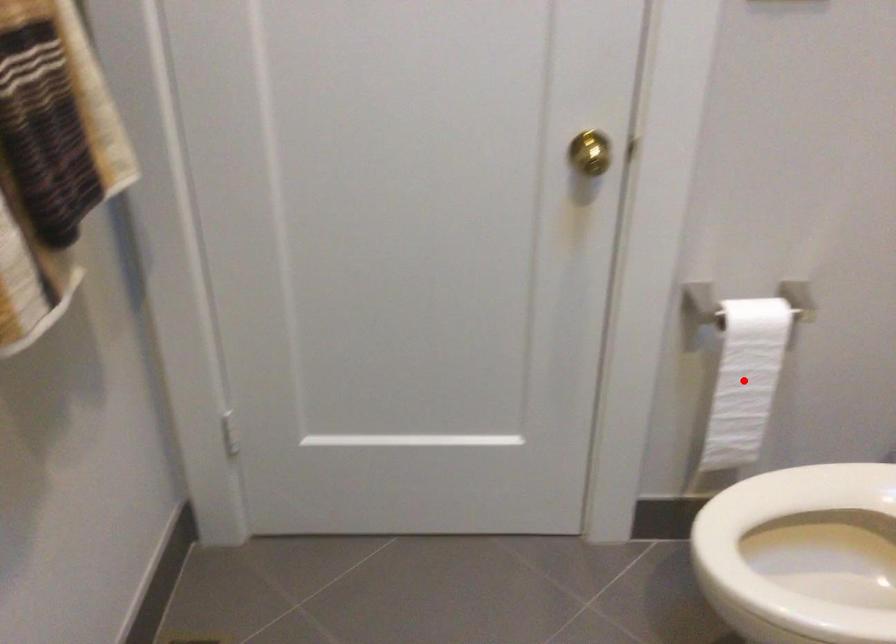
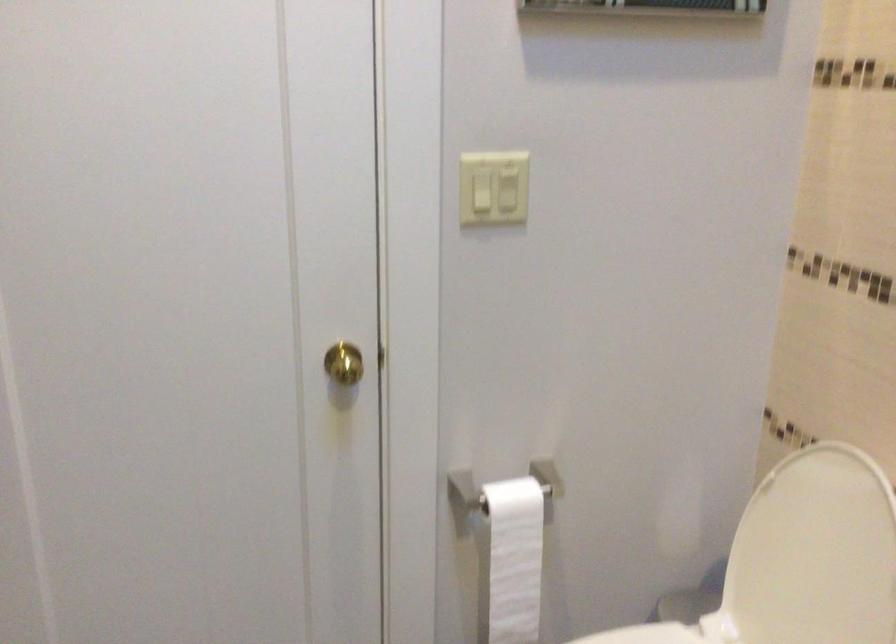
Locate, in the second image, the point that corresponds to the highlighted location in the first image.

(513, 560)